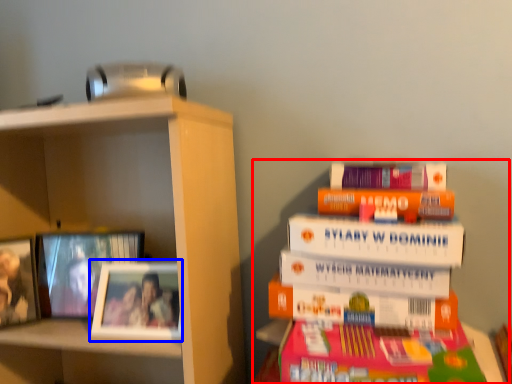
Question: Which of the following is the closest to the observer, book (highlighted by a red box) or picture frame (highlighted by a blue box)?

Choices:
 (A) book
 (B) picture frame

Answer: (A)